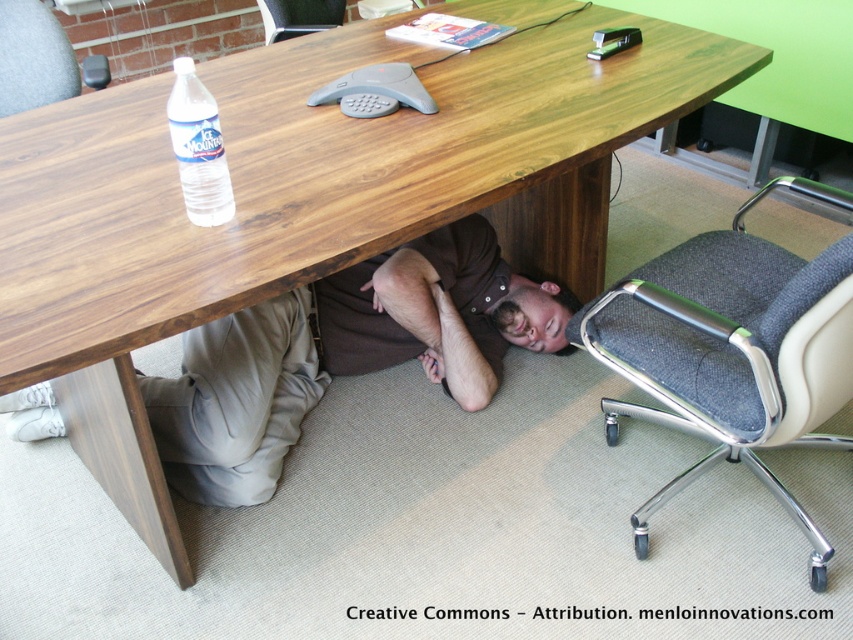
How distant is gray fabric chair at lower left from smooth brown hair at under desk?

They are 4.42 feet apart.

Does gray fabric chair at lower left appear on the right side of smooth brown hair at under desk?

Incorrect, gray fabric chair at lower left is not on the right side of smooth brown hair at under desk.

This screenshot has height=640, width=853. Describe the element at coordinates (33, 58) in the screenshot. I see `gray fabric chair at lower left` at that location.

Where is `gray fabric chair at lower left`? The width and height of the screenshot is (853, 640). gray fabric chair at lower left is located at coordinates (33, 58).

Is gray fabric chair at lower left smaller than clear plastic bottle at lower left?

Incorrect, gray fabric chair at lower left is not smaller in size than clear plastic bottle at lower left.

Is point (3, 13) farther from camera compared to point (178, 61)?

That is True.

Is point (12, 49) closer to camera compared to point (204, 179)?

No.

Identify the location of gray fabric chair at lower left. The height and width of the screenshot is (640, 853). (33, 58).

Can you confirm if brown cotton shirt at under table is wider than gray fabric swivel chair at lower right?

Yes.

Is the position of brown cotton shirt at under table more distant than that of gray fabric swivel chair at lower right?

Yes, brown cotton shirt at under table is further from the viewer.

Between point (480, 323) and point (665, 497), which one is positioned in front?

Point (665, 497) is in front.

Locate an element on the screen. This screenshot has height=640, width=853. brown cotton shirt at under table is located at coordinates (343, 353).